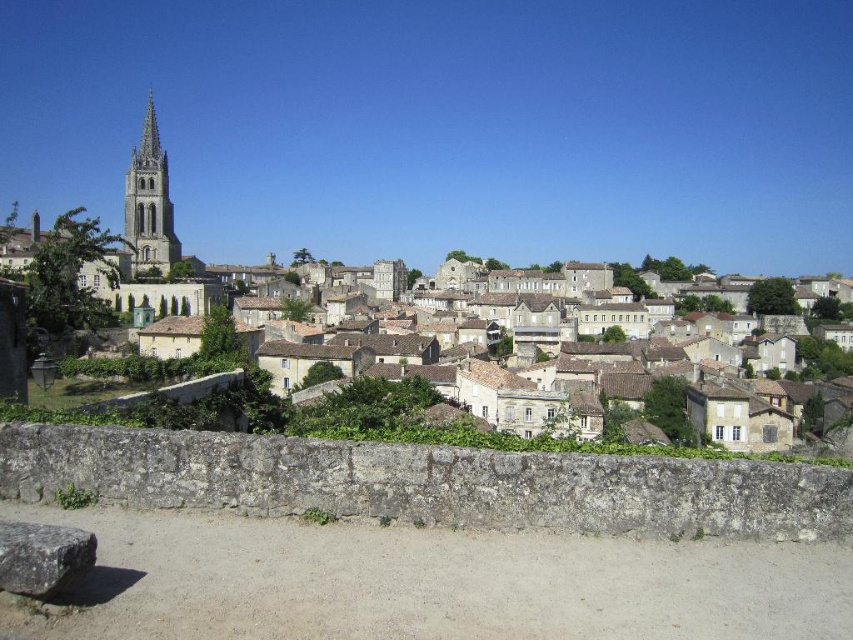
Question: Does stone houses at center appear under smooth stone tower at upper left?

Choices:
 (A) no
 (B) yes

Answer: (B)

Question: Is stone houses at center smaller than smooth stone tower at upper left?

Choices:
 (A) yes
 (B) no

Answer: (B)

Question: Which point is farther from the camera taking this photo?

Choices:
 (A) (152, 179)
 (B) (521, 284)

Answer: (B)

Question: Which object appears farthest from the camera in this image?

Choices:
 (A) smooth stone tower at upper left
 (B) stone houses at center

Answer: (A)

Question: Is stone houses at center to the right of smooth stone tower at upper left from the viewer's perspective?

Choices:
 (A) yes
 (B) no

Answer: (A)